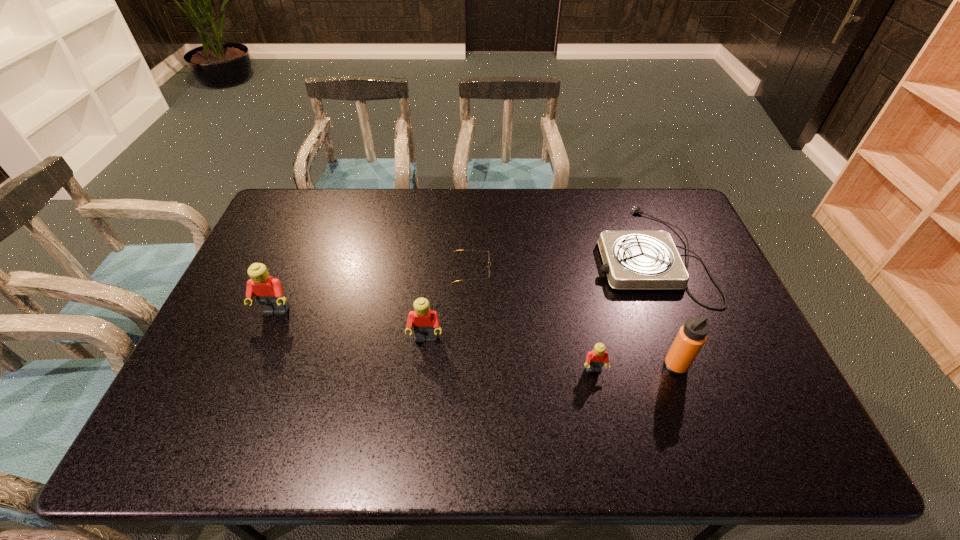
Identify the location of free space at the far edge of the desktop. This screenshot has height=540, width=960. (539, 204).

Locate an element on the screen. This screenshot has width=960, height=540. vacant space at the near edge is located at coordinates (575, 410).

You are a GUI agent. You are given a task and a screenshot of the screen. Output one action in this format:
    pyautogui.click(x=<x>, y=<y>)
    Task: Click on the vacant space at the left edge
    
    Given the screenshot: What is the action you would take?
    pyautogui.click(x=276, y=278)

This screenshot has width=960, height=540. In order to click on free location at the right edge in this screenshot , I will do pyautogui.click(x=688, y=302).

At what (x,y) coordinates should I click in order to perform the action: click on vacant area between the hotplate and the thermos bottle. Please return your answer as a coordinate pair (x, y). This screenshot has width=960, height=540. Looking at the image, I should click on (662, 310).

Where is `vacant region between the leftmost Lego and the hotplate`? vacant region between the leftmost Lego and the hotplate is located at coordinates (462, 283).

This screenshot has height=540, width=960. Find the location of `free point between the hotplate and the thermos bottle`. free point between the hotplate and the thermos bottle is located at coordinates (662, 310).

The height and width of the screenshot is (540, 960). Identify the location of free spot between the second Lego from left to right and the leftmost object. (350, 325).

Locate an element on the screen. free space between the leftmost object and the second shortest Lego is located at coordinates coord(350,325).

Locate an element on the screen. free space between the hotplate and the third object from left to right is located at coordinates (560, 263).